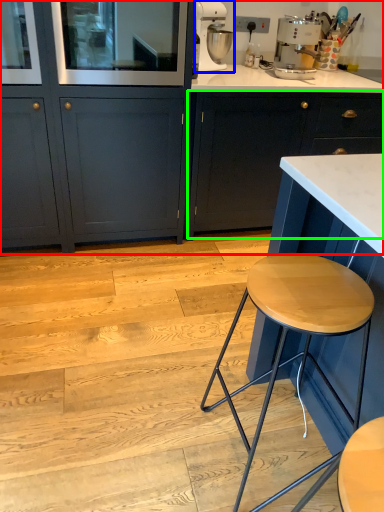
Question: Based on their relative distances, which object is nearer to cabinetry (highlighted by a red box)? Choose from kitchen appliance (highlighted by a blue box) and cabinetry (highlighted by a green box).

Choices:
 (A) kitchen appliance
 (B) cabinetry

Answer: (B)